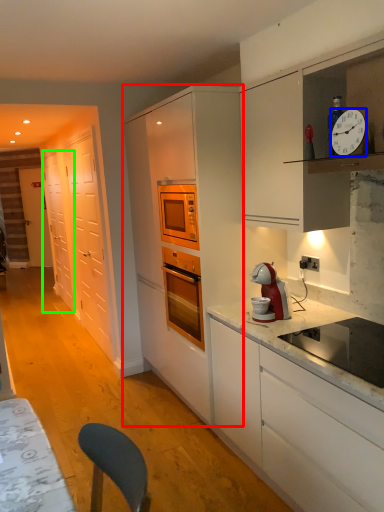
Question: Which object is the farthest from cabinetry (highlighted by a red box)? Choose among these: clock (highlighted by a blue box) or glass door (highlighted by a green box).

Choices:
 (A) clock
 (B) glass door

Answer: (B)